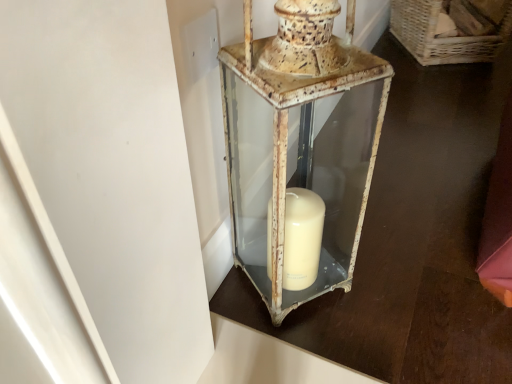
Question: Is woven wicker basket at upper right taller or shorter than rusty metal lantern at center?

Choices:
 (A) tall
 (B) short

Answer: (B)

Question: Does point (395, 36) appear closer or farther from the camera than point (249, 241)?

Choices:
 (A) farther
 (B) closer

Answer: (A)

Question: Is woven wicker basket at upper right wider or thinner than rusty metal lantern at center?

Choices:
 (A) wide
 (B) thin

Answer: (A)

Question: Considering the positions of rusty metal lantern at center and woven wicker basket at upper right in the image, is rusty metal lantern at center taller or shorter than woven wicker basket at upper right?

Choices:
 (A) short
 (B) tall

Answer: (B)

Question: Based on their sizes in the image, would you say rusty metal lantern at center is bigger or smaller than woven wicker basket at upper right?

Choices:
 (A) small
 (B) big

Answer: (A)

Question: Relative to woven wicker basket at upper right, is rusty metal lantern at center in front or behind?

Choices:
 (A) behind
 (B) front

Answer: (B)

Question: From a real-world perspective, is rusty metal lantern at center above or below woven wicker basket at upper right?

Choices:
 (A) below
 (B) above

Answer: (B)